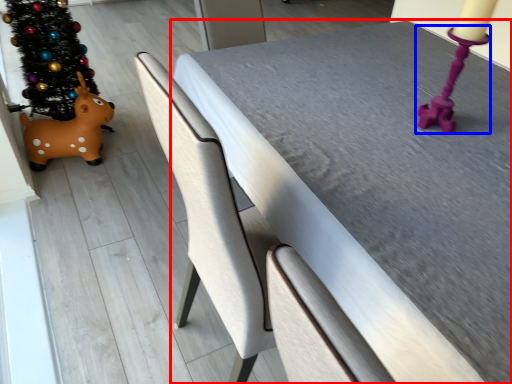
Question: Which object appears farthest to the camera in this image, table (highlighted by a red box) or candle holder (highlighted by a blue box)?

Choices:
 (A) table
 (B) candle holder

Answer: (B)